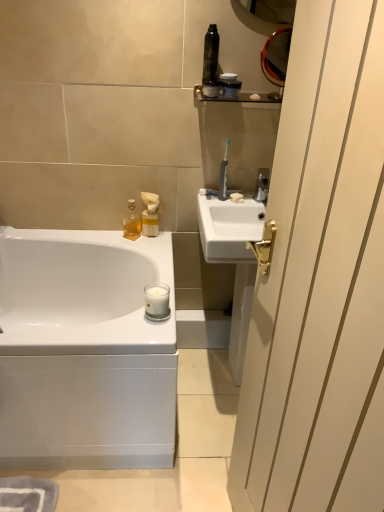
Question: From the image's perspective, is shiny black canister at upper center, the third toiletry from the back, above or below satin black container at upper center, positioned as the second toiletry in bottom-to-top order?

Choices:
 (A) above
 (B) below

Answer: (A)

Question: Looking at the image, does shiny black canister at upper center, which is counted as the 2th toiletry, starting from the right, seem bigger or smaller compared to satin black container at upper center, positioned as the second toiletry in bottom-to-top order?

Choices:
 (A) small
 (B) big

Answer: (B)

Question: Considering the real-world distances, which object is closest to the metallic silver shelf at upper center?

Choices:
 (A) white glossy screen door at right
 (B) white glossy bathtub at lower left
 (C) translucent glass bottle at upper left, which is the third toiletry from right to left
 (D) white plastic toothbrush at upper right
 (E) shiny black canister at upper center, the third toiletry from the back

Answer: (E)

Question: Which object is positioned closest to the white glossy bathtub at lower left?

Choices:
 (A) satin black container at upper center, positioned as the 2th toiletry in back-to-front order
 (B) shiny black canister at upper center, the third toiletry from the back
 (C) translucent glass bottle at upper left, which appears as the 1th toiletry when ordered from the bottom
 (D) white plastic toothbrush at upper right
 (E) metallic silver shelf at upper center

Answer: (C)